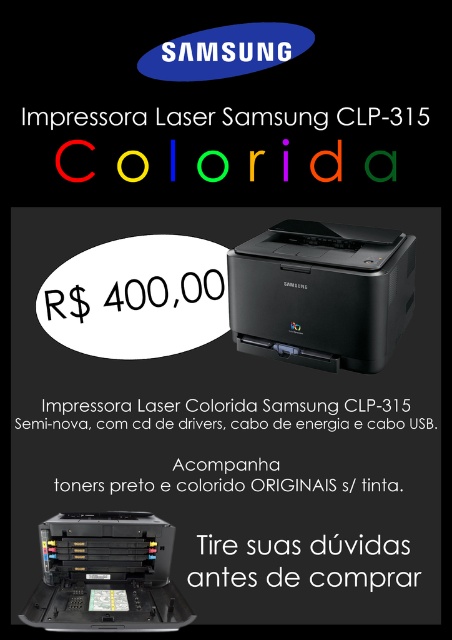
Question: Can you confirm if black plastic printer at center is positioned below matte black printer at lower center?

Choices:
 (A) no
 (B) yes

Answer: (A)

Question: Can you confirm if black plastic printer at center is thinner than white paper at center?

Choices:
 (A) no
 (B) yes

Answer: (B)

Question: Among these objects, which one is nearest to the camera?

Choices:
 (A) white paper at center
 (B) black plastic printer at center

Answer: (B)

Question: Which of the following is the farthest from the observer?

Choices:
 (A) (316, 406)
 (B) (361, 113)
 (C) (205, 538)
 (D) (145, 529)

Answer: (B)

Question: Which point is farther to the camera?

Choices:
 (A) (395, 288)
 (B) (192, 118)
 (C) (376, 550)
 (D) (93, 627)

Answer: (B)

Question: Is black plastic printer at center below colorida plastic impressora laser at center?

Choices:
 (A) yes
 (B) no

Answer: (B)